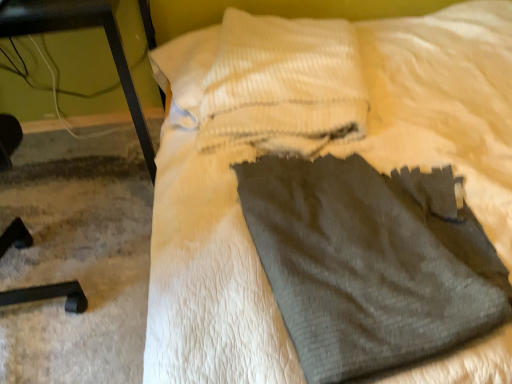
Question: Is black metal table at left at the right side of white textured pillow at upper center?

Choices:
 (A) yes
 (B) no

Answer: (B)

Question: Is black metal table at left outside of white textured pillow at upper center?

Choices:
 (A) no
 (B) yes

Answer: (B)

Question: Is black metal table at left bigger than white textured pillow at upper center?

Choices:
 (A) no
 (B) yes

Answer: (B)

Question: Is white textured pillow at upper center at the back of black metal table at left?

Choices:
 (A) no
 (B) yes

Answer: (A)

Question: From the image's perspective, is black metal table at left below white textured pillow at upper center?

Choices:
 (A) yes
 (B) no

Answer: (A)

Question: From the image's perspective, does black metal table at left appear higher than white textured pillow at upper center?

Choices:
 (A) no
 (B) yes

Answer: (A)

Question: From the image's perspective, is black metal table at left over dark gray fabric sweat pants at center?

Choices:
 (A) no
 (B) yes

Answer: (B)

Question: From a real-world perspective, is black metal table at left located beneath dark gray fabric sweat pants at center?

Choices:
 (A) yes
 (B) no

Answer: (A)

Question: Does black metal table at left have a larger size compared to dark gray fabric sweat pants at center?

Choices:
 (A) no
 (B) yes

Answer: (B)

Question: Is black metal table at left at the left side of dark gray fabric sweat pants at center?

Choices:
 (A) no
 (B) yes

Answer: (B)

Question: Is the depth of black metal table at left greater than that of dark gray fabric sweat pants at center?

Choices:
 (A) no
 (B) yes

Answer: (B)

Question: Can you confirm if black metal table at left is taller than dark gray fabric sweat pants at center?

Choices:
 (A) no
 (B) yes

Answer: (B)

Question: Is dark gray fabric sweat pants at center a part of white textured pillow at upper center?

Choices:
 (A) yes
 (B) no

Answer: (B)